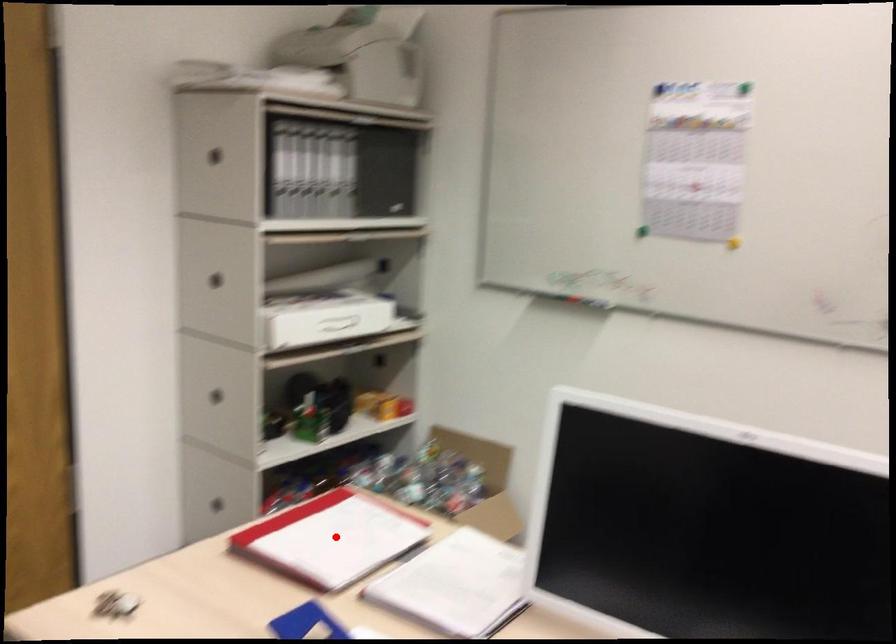
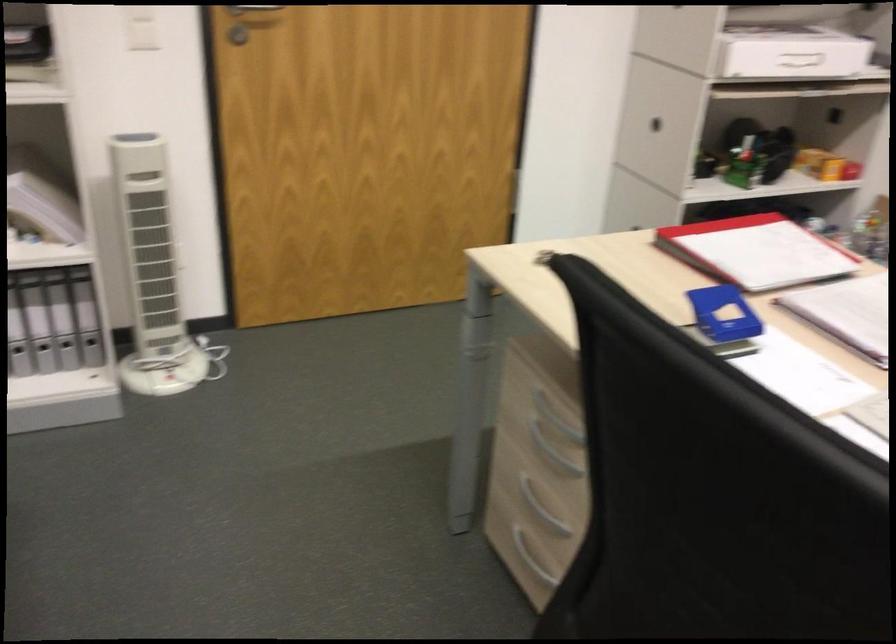
Locate, in the second image, the point that corresponds to the highlighted location in the first image.

(756, 251)